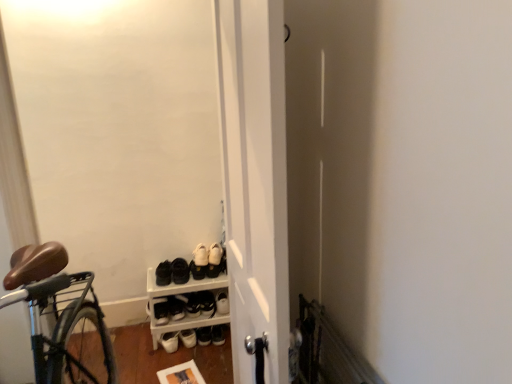
Question: Is white plastic shoe rack at lower center positioned with its back to black leather shoe at center, which ranks as the 2th footwear in right-to-left order?

Choices:
 (A) yes
 (B) no

Answer: (A)

Question: Can you confirm if white plastic shoe rack at lower center is thinner than black leather shoe at center, which ranks as the 2th footwear in right-to-left order?

Choices:
 (A) no
 (B) yes

Answer: (A)

Question: From a real-world perspective, is white plastic shoe rack at lower center located higher than black leather shoe at center, which ranks as the 2th footwear in right-to-left order?

Choices:
 (A) no
 (B) yes

Answer: (B)

Question: Is white plastic shoe rack at lower center aimed at black leather shoe at center, arranged as the 4th footwear when viewed from the left?

Choices:
 (A) no
 (B) yes

Answer: (B)

Question: From the image's perspective, is white plastic shoe rack at lower center on top of black leather shoe at center, which ranks as the 2th footwear in right-to-left order?

Choices:
 (A) yes
 (B) no

Answer: (B)

Question: From the image's perspective, is black leather shoe at center, which ranks as the 2th footwear in right-to-left order, located above or below white plastic shoe rack at lower center?

Choices:
 (A) above
 (B) below

Answer: (A)

Question: In terms of size, does black leather shoe at center, which ranks as the 2th footwear in right-to-left order, appear bigger or smaller than white plastic shoe rack at lower center?

Choices:
 (A) small
 (B) big

Answer: (A)

Question: Is black leather shoe at center, which ranks as the 2th footwear in right-to-left order, in front of or behind white plastic shoe rack at lower center in the image?

Choices:
 (A) front
 (B) behind

Answer: (B)

Question: From a real-world perspective, relative to white plastic shoe rack at lower center, is black leather shoe at center, which ranks as the 2th footwear in right-to-left order, vertically above or below?

Choices:
 (A) above
 (B) below

Answer: (B)

Question: Would you say black matte shoes at center, the 4th footwear in the right-to-left sequence, is inside or outside black leather shoe at center, arranged as the 4th footwear when viewed from the left?

Choices:
 (A) outside
 (B) inside

Answer: (A)

Question: Looking at the image, does black matte shoes at center, arranged as the 2th footwear when viewed from the left, seem bigger or smaller compared to black leather shoe at center, which ranks as the 2th footwear in right-to-left order?

Choices:
 (A) big
 (B) small

Answer: (A)

Question: Considering their positions, is black matte shoes at center, the 4th footwear in the right-to-left sequence, located in front of or behind black leather shoe at center, which ranks as the 2th footwear in right-to-left order?

Choices:
 (A) front
 (B) behind

Answer: (A)

Question: Is black matte shoes at center, the 4th footwear in the right-to-left sequence, wider or thinner than black leather shoe at center, arranged as the 4th footwear when viewed from the left?

Choices:
 (A) wide
 (B) thin

Answer: (A)

Question: Which is correct: white plastic shoe rack at lower center is inside black leather shoe at center, which ranks as the 2th footwear in right-to-left order, or outside of it?

Choices:
 (A) inside
 (B) outside

Answer: (B)

Question: Relative to black leather shoe at center, arranged as the 4th footwear when viewed from the left, is white plastic shoe rack at lower center in front or behind?

Choices:
 (A) behind
 (B) front

Answer: (B)